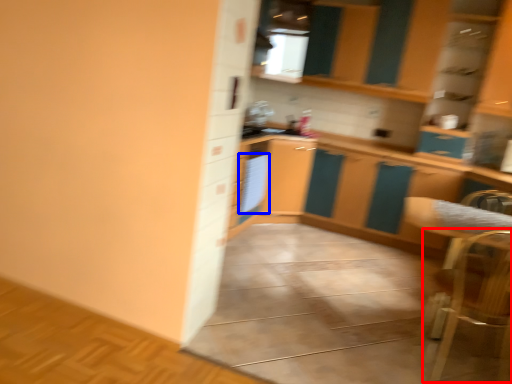
Question: Among these objects, which one is farthest to the camera, armchair (highlighted by a red box) or appliance (highlighted by a blue box)?

Choices:
 (A) armchair
 (B) appliance

Answer: (B)